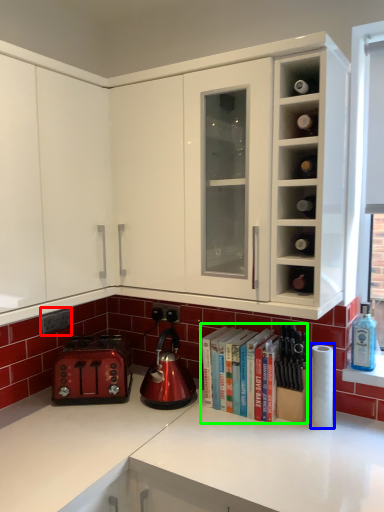
Question: Estimate the real-world distances between objects in this image. Which object is farther from electric outlet (highlighted by a red box), paper towel (highlighted by a blue box) or book (highlighted by a green box)?

Choices:
 (A) paper towel
 (B) book

Answer: (A)